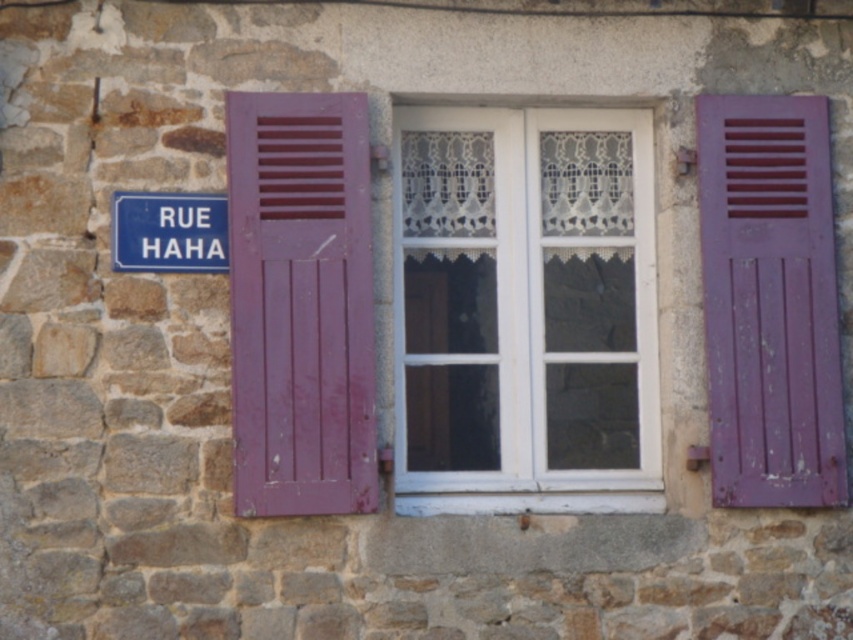
Question: Which object is the closest to the white painted wood window frame at center?

Choices:
 (A) purple matte shutter at right
 (B) blue plastic sign at upper left

Answer: (A)

Question: Is white painted wood window frame at center bigger than purple matte shutter at left?

Choices:
 (A) no
 (B) yes

Answer: (B)

Question: Which is farther from the purple matte shutter at left?

Choices:
 (A) blue plastic sign at upper left
 (B) purple matte shutter at right
 (C) white painted wood window frame at center

Answer: (B)

Question: Among these objects, which one is farthest from the camera?

Choices:
 (A) white painted wood window frame at center
 (B) blue plastic sign at upper left
 (C) purple matte shutter at right
 (D) purple matte shutter at left

Answer: (A)

Question: Does white painted wood window frame at center appear on the left side of purple matte shutter at right?

Choices:
 (A) no
 (B) yes

Answer: (B)

Question: Does white painted wood window frame at center appear on the right side of purple matte shutter at left?

Choices:
 (A) no
 (B) yes

Answer: (B)